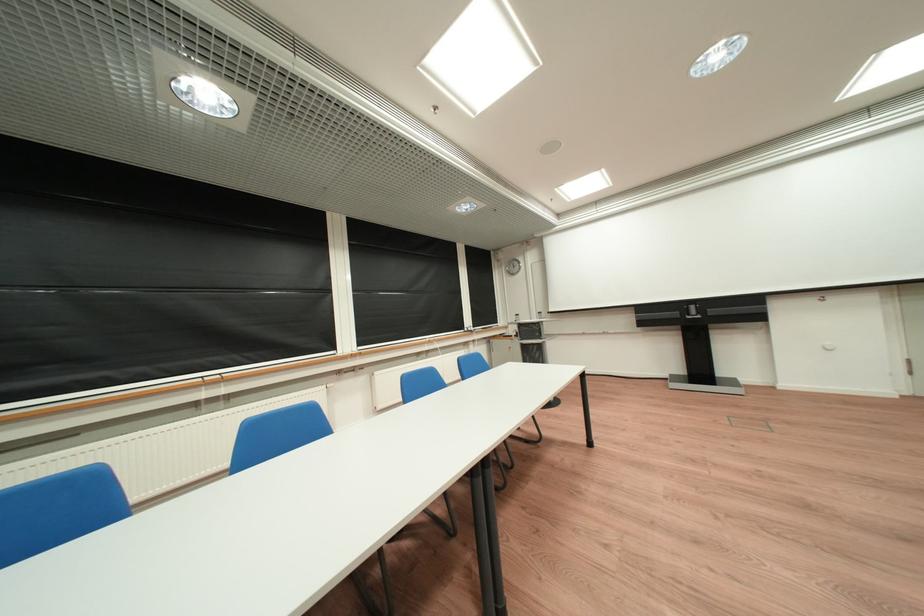
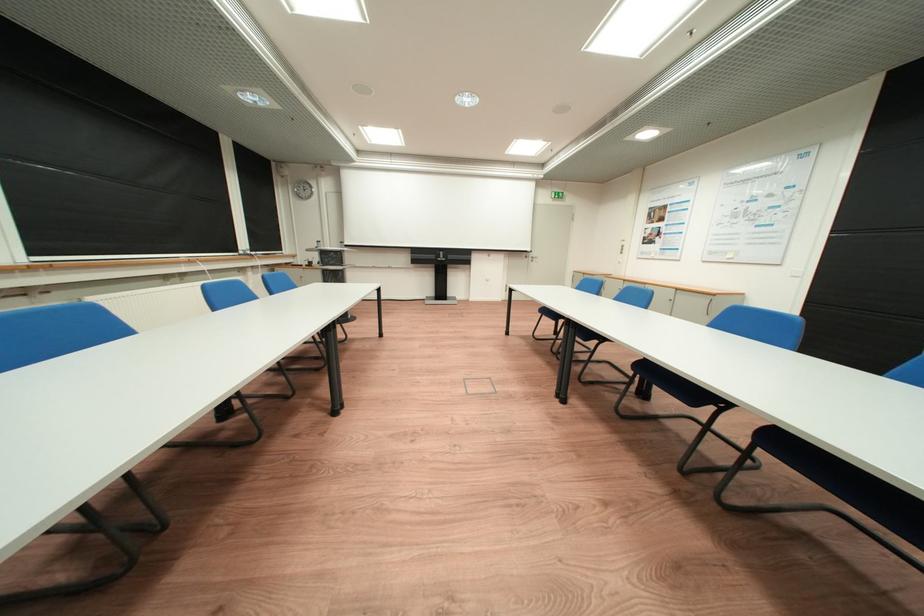
In the second image, find the point that corresponds to the point at 687,315 in the first image.

(445, 257)